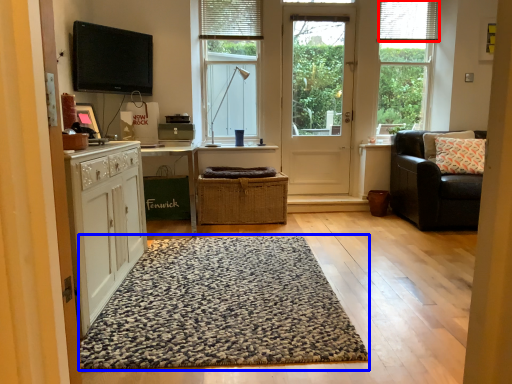
Question: Which object is closer to the camera taking this photo, blind (highlighted by a red box) or doormat (highlighted by a blue box)?

Choices:
 (A) blind
 (B) doormat

Answer: (B)